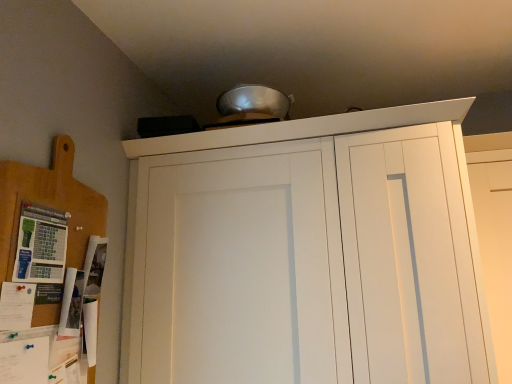
Question: Does white matte door at upper center appear on the right side of wooden cutting board at left?

Choices:
 (A) yes
 (B) no

Answer: (A)

Question: Does white matte door at upper center have a lesser height compared to wooden cutting board at left?

Choices:
 (A) no
 (B) yes

Answer: (A)

Question: Could wooden cutting board at left be considered to be inside white matte door at upper center?

Choices:
 (A) no
 (B) yes

Answer: (A)

Question: Is white matte door at upper center placed right next to wooden cutting board at left?

Choices:
 (A) yes
 (B) no

Answer: (B)

Question: Does white matte door at upper center have a greater height compared to wooden cutting board at left?

Choices:
 (A) no
 (B) yes

Answer: (B)

Question: From the image's perspective, is white matte door at upper center above or below wooden cutting board at left?

Choices:
 (A) below
 (B) above

Answer: (A)

Question: Is white matte door at upper center bigger or smaller than wooden cutting board at left?

Choices:
 (A) small
 (B) big

Answer: (B)

Question: Is white matte door at upper center to the left or to the right of wooden cutting board at left in the image?

Choices:
 (A) right
 (B) left

Answer: (A)

Question: Relative to wooden cutting board at left, is white matte door at upper center in front or behind?

Choices:
 (A) behind
 (B) front

Answer: (A)

Question: Do you think white matte door at upper center is within white matte cupboard at upper center, or outside of it?

Choices:
 (A) outside
 (B) inside

Answer: (A)

Question: Is white matte door at upper center to the left or to the right of white matte cupboard at upper center in the image?

Choices:
 (A) right
 (B) left

Answer: (A)

Question: Is point (495, 218) closer or farther from the camera than point (307, 230)?

Choices:
 (A) closer
 (B) farther

Answer: (B)

Question: Based on their sizes in the image, would you say white matte door at upper center is bigger or smaller than white matte cupboard at upper center?

Choices:
 (A) small
 (B) big

Answer: (A)

Question: Considering the positions of white matte cupboard at upper center and white matte door at upper center in the image, is white matte cupboard at upper center wider or thinner than white matte door at upper center?

Choices:
 (A) thin
 (B) wide

Answer: (B)

Question: Considering the relative positions of white matte cupboard at upper center and white matte door at upper center in the image provided, is white matte cupboard at upper center to the left or to the right of white matte door at upper center?

Choices:
 (A) right
 (B) left

Answer: (B)